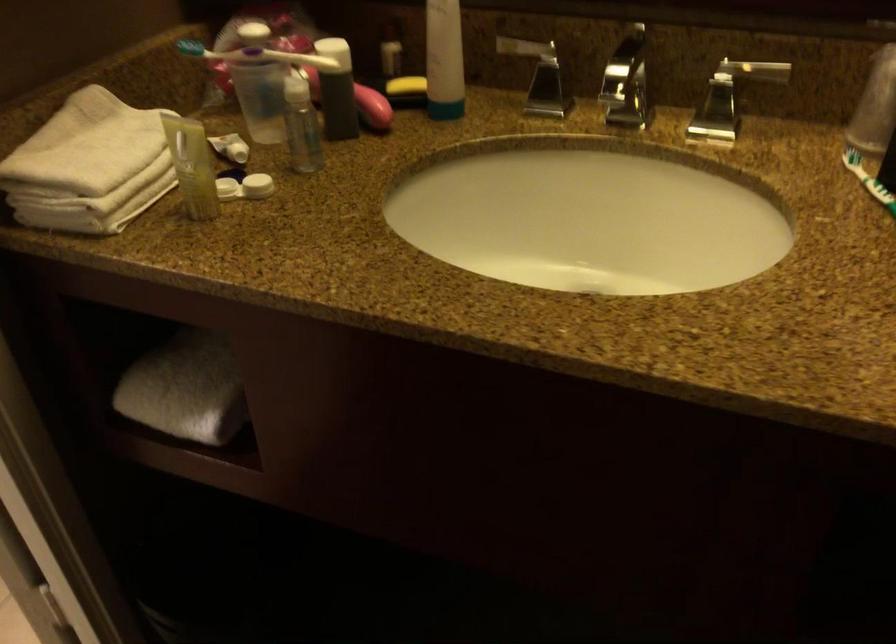
This screenshot has height=644, width=896. Identify the location of upright white tube. (444, 60).